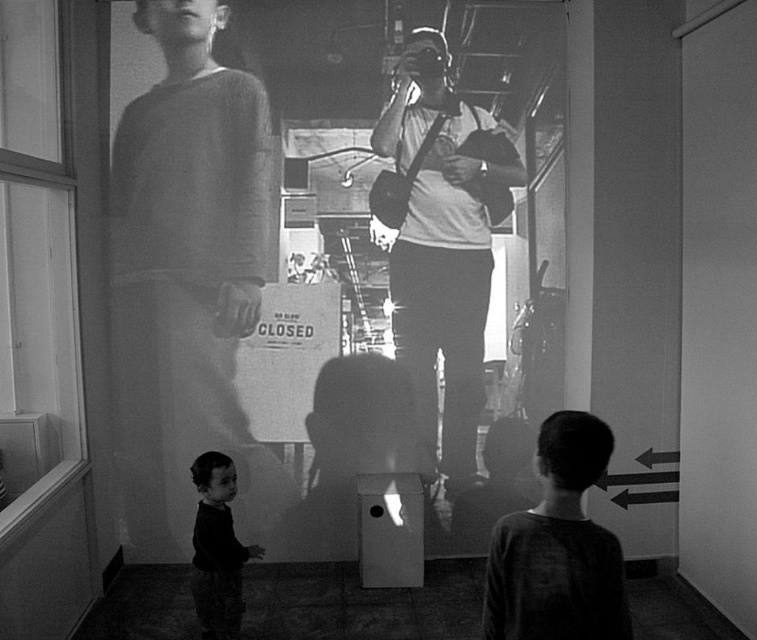
In the scene shown: Can you confirm if matte gray shirt at center is shorter than dark fabric baby at lower left?

No.

Which is in front, point (491, 170) or point (198, 616)?

Point (198, 616) is more forward.

Find the location of a particular element. matte gray shirt at center is located at coordinates (441, 244).

Who is lower down, knitted sweater at left or dark fabric baby at lower left?

Positioned lower is dark fabric baby at lower left.

Which of these two, knitted sweater at left or dark fabric baby at lower left, stands taller?

With more height is knitted sweater at left.

Is point (245, 138) in front of point (220, 580)?

No.

The width and height of the screenshot is (757, 640). Find the location of `knitted sweater at left`. knitted sweater at left is located at coordinates (184, 268).

The width and height of the screenshot is (757, 640). Describe the element at coordinates (441, 244) in the screenshot. I see `matte gray shirt at center` at that location.

Locate an element on the screen. This screenshot has height=640, width=757. matte gray shirt at center is located at coordinates (441, 244).